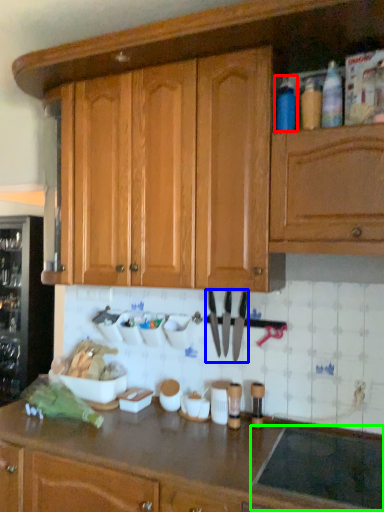
Question: Which is nearer to the bottle (highlighted by a red box)? cutlery (highlighted by a blue box) or appliance (highlighted by a green box).

Choices:
 (A) cutlery
 (B) appliance

Answer: (A)